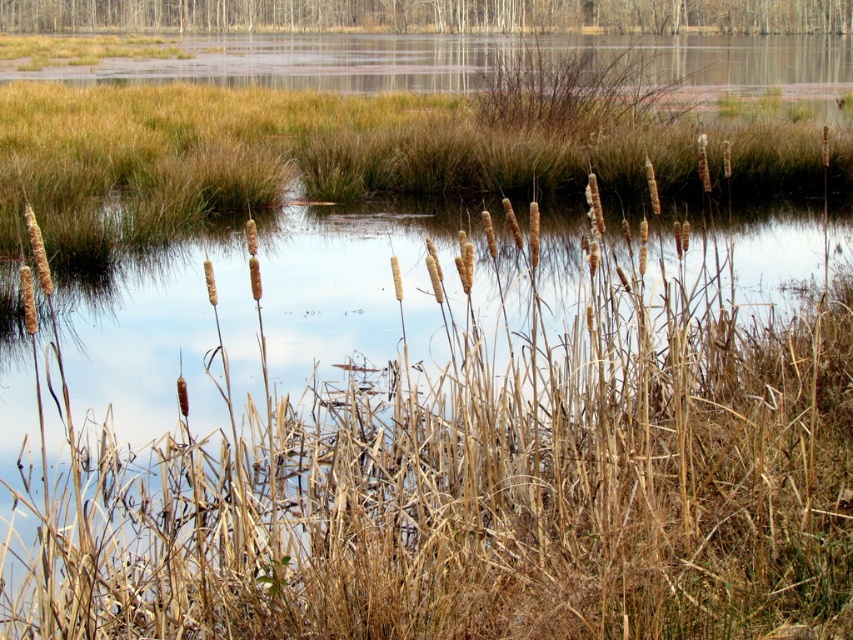
You are an ecologist studying the wetland. You observe two areas of dry grass in the scene. The first is the brown dry grass at center, and the second is the dry grass at upper center. Which area has a wider spread of dry grass?

The dry grass at upper center has a wider spread compared to the brown dry grass at center as per the description.